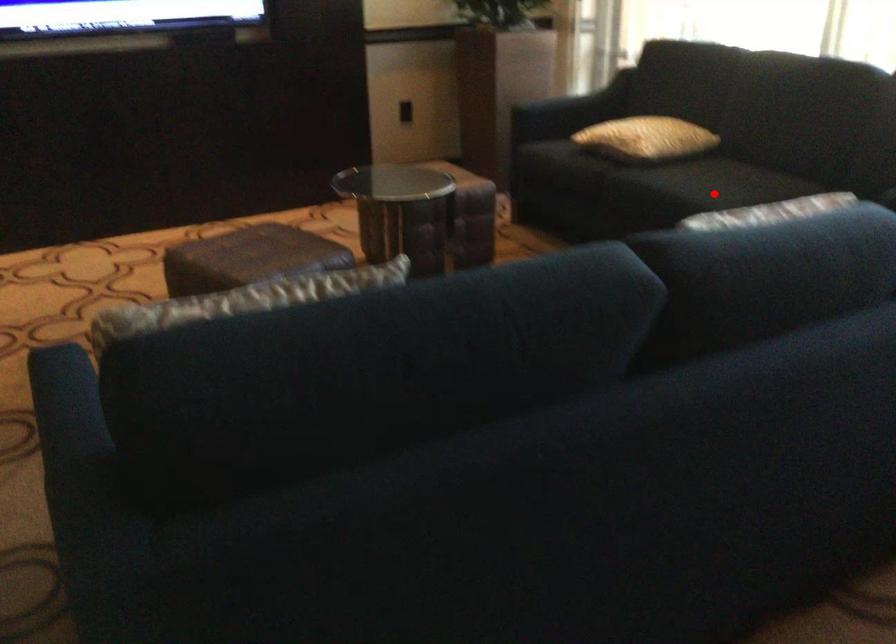
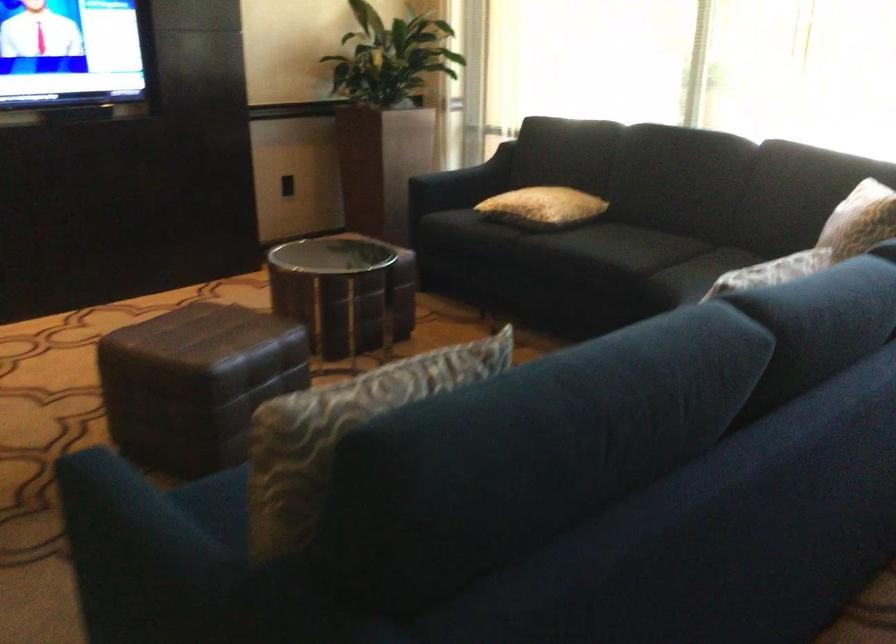
The point at the highlighted location is marked in the first image. Where is the corresponding point in the second image?

(626, 254)